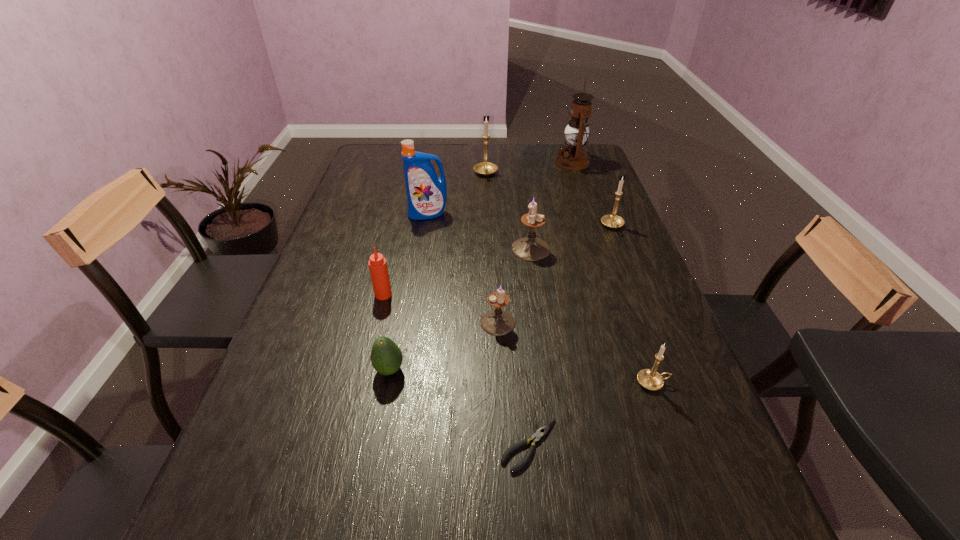
Identify the location of the smaller purple candle holder. This screenshot has height=540, width=960. (497, 322).

The width and height of the screenshot is (960, 540). In order to click on the fourth nearest object in this screenshot , I will do `click(497, 322)`.

Locate an element on the screen. the nearest candle holder is located at coordinates (650, 379).

Where is `the smallest gold candle holder`? Image resolution: width=960 pixels, height=540 pixels. the smallest gold candle holder is located at coordinates (650, 379).

Locate an element on the screen. green avocado is located at coordinates (386, 357).

The width and height of the screenshot is (960, 540). Identify the location of the ninth tallest object. (386, 357).

Locate an element on the screen. The width and height of the screenshot is (960, 540). pliers is located at coordinates (542, 431).

Identify the location of the shortest object. This screenshot has height=540, width=960. (542, 431).

Where is `vacant space located 0.230m on the side of the tallest object, there is a wick adjustment knob`? vacant space located 0.230m on the side of the tallest object, there is a wick adjustment knob is located at coordinates (495, 163).

Where is `blank space located on the side of the tallest object, there is a wick adjustment knob`? blank space located on the side of the tallest object, there is a wick adjustment knob is located at coordinates (482, 163).